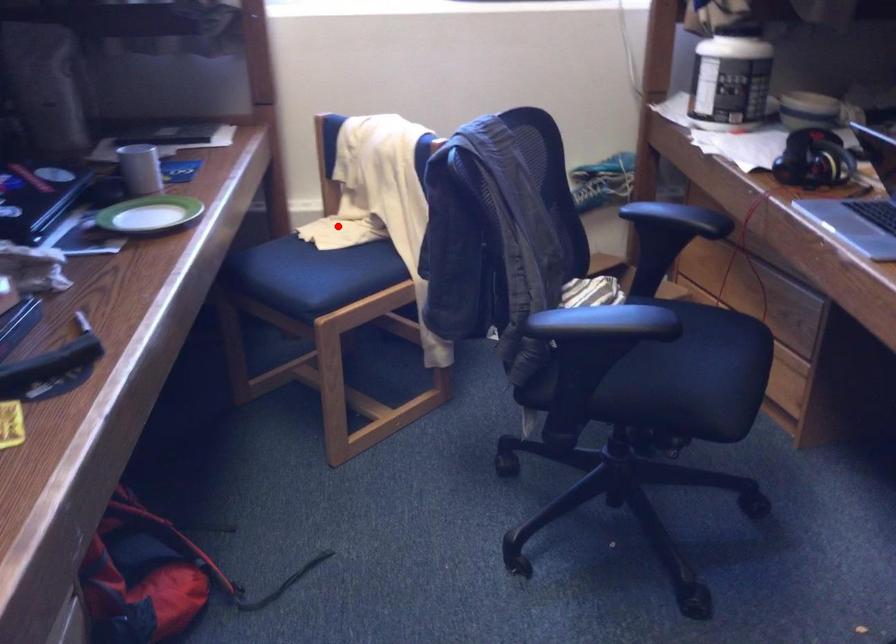
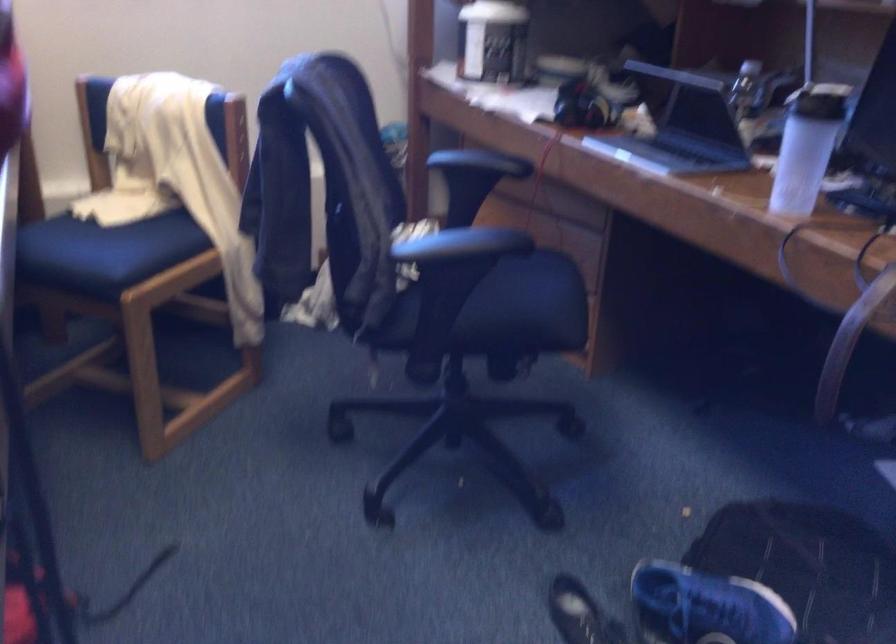
In the second image, find the point that corresponds to the highlighted location in the first image.

(123, 200)